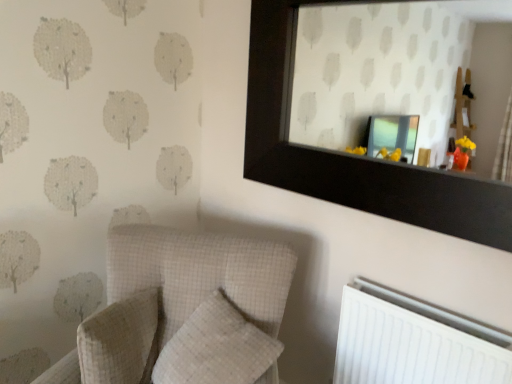
Question: Considering the relative positions of white checkered pillow at lower left, the 1th pillow when ordered from left to right, and black wooden mirror at upper center in the image provided, is white checkered pillow at lower left, the 1th pillow when ordered from left to right, to the left or to the right of black wooden mirror at upper center?

Choices:
 (A) right
 (B) left

Answer: (B)

Question: In the image, is white checkered pillow at lower left, the second pillow in the right-to-left sequence, positioned in front of or behind black wooden mirror at upper center?

Choices:
 (A) behind
 (B) front

Answer: (A)

Question: Based on their relative distances, which object is nearer to the white checkered pillow at center, the first pillow viewed from the right?

Choices:
 (A) black wooden mirror at upper center
 (B) white checkered pillow at lower left, the 1th pillow when ordered from left to right
 (C) white plastic radiator at lower right
 (D) textured beige armchair at lower left

Answer: (D)

Question: Which object is the farthest from the black wooden mirror at upper center?

Choices:
 (A) textured beige armchair at lower left
 (B) white checkered pillow at lower left, the 1th pillow when ordered from left to right
 (C) white checkered pillow at center, the first pillow viewed from the right
 (D) white plastic radiator at lower right

Answer: (B)